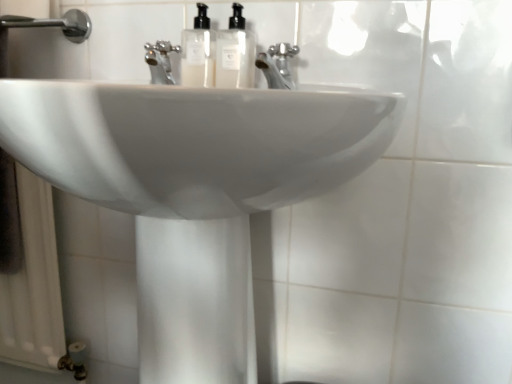
Describe the element at coordinates (193, 188) in the screenshot. I see `white glossy sink at center` at that location.

The height and width of the screenshot is (384, 512). Identify the location of chrome metallic faucet at center. (277, 65).

At what (x,y) coordinates should I click in order to perform the action: click on white glossy sink at center. Please return your answer as a coordinate pair (x, y). Looking at the image, I should click on (193, 188).

From a real-world perspective, which object stands above the other?

chrome metallic faucet at center is physically above.

Is white glossy sink at center aimed at chrome metallic faucet at center?

No, white glossy sink at center is not aimed at chrome metallic faucet at center.

Is white glossy sink at center beside chrome metallic faucet at center?

No, white glossy sink at center is not beside chrome metallic faucet at center.

Considering the sizes of objects white glossy sink at center and chrome metallic faucet at center in the image provided, who is wider, white glossy sink at center or chrome metallic faucet at center?

white glossy sink at center.

Can you confirm if chrome metallic faucet at center is positioned to the left of white glossy sink at center?

No, chrome metallic faucet at center is not to the left of white glossy sink at center.

Who is more distant, chrome metallic faucet at center or white glossy sink at center?

chrome metallic faucet at center is further from the camera.

Is chrome metallic faucet at center thinner than white glossy sink at center?

Indeed, chrome metallic faucet at center has a lesser width compared to white glossy sink at center.

Which is more to the right, translucent plastic soap dispenser at center, which is the first soap dispenser in left-to-right order, or chrome metallic faucet at center?

Positioned to the right is chrome metallic faucet at center.

Is translucent plastic soap dispenser at center, which is the 2th soap dispenser from right to left, oriented away from chrome metallic faucet at center?

No.

From a real-world perspective, is translucent plastic soap dispenser at center, which is the first soap dispenser in left-to-right order, physically above chrome metallic faucet at center?

Yes, from a real-world perspective, translucent plastic soap dispenser at center, which is the first soap dispenser in left-to-right order, is on top of chrome metallic faucet at center.

From a real-world perspective, which object stands above the other?

translucent plastic soap dispenser at center, which is the 2th soap dispenser from right to left.

Image resolution: width=512 pixels, height=384 pixels. I want to click on soap dispenser that appears below the translucent plastic soap dispenser at center, which is the first soap dispenser in left-to-right order (from the image's perspective), so click(x=234, y=53).

From the image's perspective, which one is positioned higher, translucent plastic soap dispenser at center, the second soap dispenser viewed from the left, or translucent plastic soap dispenser at center, which is the 2th soap dispenser from right to left?

From the image's view, translucent plastic soap dispenser at center, which is the 2th soap dispenser from right to left, is above.

From their relative heights in the image, would you say translucent plastic soap dispenser at center, the second soap dispenser viewed from the left, is taller or shorter than translucent plastic soap dispenser at center, which is the 2th soap dispenser from right to left?

In the image, translucent plastic soap dispenser at center, the second soap dispenser viewed from the left, appears to be taller than translucent plastic soap dispenser at center, which is the 2th soap dispenser from right to left.

Considering the relative sizes of chrome metallic faucet at center and translucent plastic soap dispenser at center, which is the 2th soap dispenser from right to left, in the image provided, is chrome metallic faucet at center taller than translucent plastic soap dispenser at center, which is the 2th soap dispenser from right to left,?

No, chrome metallic faucet at center is not taller than translucent plastic soap dispenser at center, which is the 2th soap dispenser from right to left.

Which is nearer, (292,86) or (191,65)?

Point (292,86).

From a real-world perspective, is chrome metallic faucet at center over translucent plastic soap dispenser at center, which is the 2th soap dispenser from right to left?

No, from a real-world perspective, chrome metallic faucet at center is not above translucent plastic soap dispenser at center, which is the 2th soap dispenser from right to left.

Is white glossy sink at center inside translucent plastic soap dispenser at center, placed as the 1th soap dispenser when sorted from right to left?

No, white glossy sink at center is not surrounded by translucent plastic soap dispenser at center, placed as the 1th soap dispenser when sorted from right to left.

From a real-world perspective, which is physically below, translucent plastic soap dispenser at center, placed as the 1th soap dispenser when sorted from right to left, or white glossy sink at center?

white glossy sink at center.

Is translucent plastic soap dispenser at center, the second soap dispenser viewed from the left, facing away from white glossy sink at center?

No, translucent plastic soap dispenser at center, the second soap dispenser viewed from the left,'s orientation is not away from white glossy sink at center.

Which object is further away from the camera taking this photo, translucent plastic soap dispenser at center, the second soap dispenser viewed from the left, or white glossy sink at center?

Positioned behind is translucent plastic soap dispenser at center, the second soap dispenser viewed from the left.

Is translucent plastic soap dispenser at center, placed as the 1th soap dispenser when sorted from right to left, facing away from chrome metallic faucet at center?

No, chrome metallic faucet at center is not at the back of translucent plastic soap dispenser at center, placed as the 1th soap dispenser when sorted from right to left.

From the image's perspective, between translucent plastic soap dispenser at center, the second soap dispenser viewed from the left, and chrome metallic faucet at center, who is located below?

chrome metallic faucet at center, from the image's perspective.

Where is `tap that is above the white glossy sink at center (from the image's perspective)`? This screenshot has height=384, width=512. tap that is above the white glossy sink at center (from the image's perspective) is located at coordinates (277, 65).

You are a GUI agent. You are given a task and a screenshot of the screen. Output one action in this format:
    pyautogui.click(x=<x>, y=<y>)
    Task: Click on the sink lying in front of the chrome metallic faucet at center
    
    Given the screenshot: What is the action you would take?
    pyautogui.click(x=193, y=188)

From the image, which object appears to be farther from translucent plastic soap dispenser at center, which is the first soap dispenser in left-to-right order, chrome metallic faucet at center or white glossy sink at center?

The object further to translucent plastic soap dispenser at center, which is the first soap dispenser in left-to-right order, is white glossy sink at center.

Based on their spatial positions, is translucent plastic soap dispenser at center, the second soap dispenser viewed from the left, or white glossy sink at center closer to chrome metallic faucet at center?

translucent plastic soap dispenser at center, the second soap dispenser viewed from the left.

Based on their spatial positions, is translucent plastic soap dispenser at center, which is the 2th soap dispenser from right to left, or translucent plastic soap dispenser at center, the second soap dispenser viewed from the left, further from chrome metallic faucet at center?

The object further to chrome metallic faucet at center is translucent plastic soap dispenser at center, which is the 2th soap dispenser from right to left.

Estimate the real-world distances between objects in this image. Which object is closer to white glossy sink at center, chrome metallic faucet at center or translucent plastic soap dispenser at center, placed as the 1th soap dispenser when sorted from right to left?

translucent plastic soap dispenser at center, placed as the 1th soap dispenser when sorted from right to left, is closer to white glossy sink at center.

Looking at this image, estimate the real-world distances between objects in this image. Which object is closer to translucent plastic soap dispenser at center, which is the 2th soap dispenser from right to left, chrome metallic faucet at center or translucent plastic soap dispenser at center, placed as the 1th soap dispenser when sorted from right to left?

translucent plastic soap dispenser at center, placed as the 1th soap dispenser when sorted from right to left, is positioned closer to the anchor translucent plastic soap dispenser at center, which is the 2th soap dispenser from right to left.

Based on their spatial positions, is white glossy sink at center or chrome metallic faucet at center further from translucent plastic soap dispenser at center, which is the first soap dispenser in left-to-right order?

white glossy sink at center.

Estimate the real-world distances between objects in this image. Which object is further from translucent plastic soap dispenser at center, the second soap dispenser viewed from the left, translucent plastic soap dispenser at center, which is the first soap dispenser in left-to-right order, or chrome metallic faucet at center?

chrome metallic faucet at center lies further to translucent plastic soap dispenser at center, the second soap dispenser viewed from the left, than the other object.

Estimate the real-world distances between objects in this image. Which object is further from white glossy sink at center, translucent plastic soap dispenser at center, the second soap dispenser viewed from the left, or chrome metallic faucet at center?

Based on the image, chrome metallic faucet at center appears to be further to white glossy sink at center.

Identify the location of tap between translucent plastic soap dispenser at center, which is the 2th soap dispenser from right to left, and white glossy sink at center vertically. The width and height of the screenshot is (512, 384). (277, 65).

Where is `soap dispenser between translucent plastic soap dispenser at center, which is the 2th soap dispenser from right to left, and chrome metallic faucet at center`? soap dispenser between translucent plastic soap dispenser at center, which is the 2th soap dispenser from right to left, and chrome metallic faucet at center is located at coordinates (234, 53).

The width and height of the screenshot is (512, 384). I want to click on soap dispenser between translucent plastic soap dispenser at center, which is the 2th soap dispenser from right to left, and white glossy sink at center in the up-down direction, so click(234, 53).

Locate an element on the screen. The width and height of the screenshot is (512, 384). tap between translucent plastic soap dispenser at center, the second soap dispenser viewed from the left, and white glossy sink at center vertically is located at coordinates (277, 65).